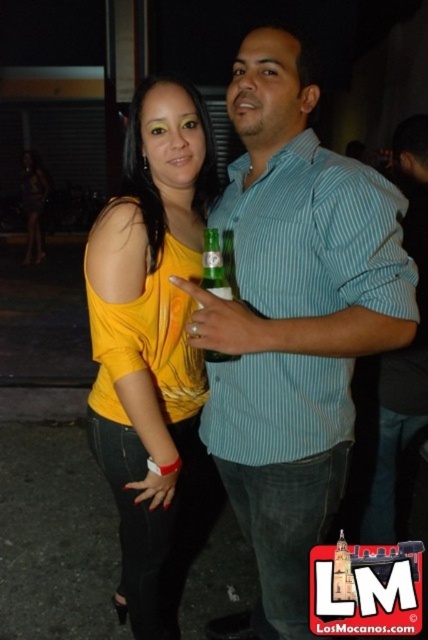
You are a photographer trying to capture the two people in the image. You notice the matte yellow tank top at center and the yellow matte tank top at center. Which one appears larger in the photo?

The yellow matte tank top at center appears larger than the matte yellow tank top at center because the description states that the matte yellow tank top at center is smaller than the yellow matte tank top at center.

You are a photographer trying to focus on the matte blue shirt at center in the image. What are the exact coordinates where you should aim your camera?

The matte blue shirt at center is located at coordinates point [293,323].

You are a photographer trying to capture a closeup shot of both the matte blue shirt at center and the matte yellow tank top at center. Your camera has a maximum focus range of 10 inches. Can you fit both items within the camera frame without moving the subjects?

The matte blue shirt at center and matte yellow tank top at center are 11.02 inches apart. Since the distance between them exceeds the camera maximum focus range of 10 inches, you cannot fit both items within the camera frame without moving the subjects.